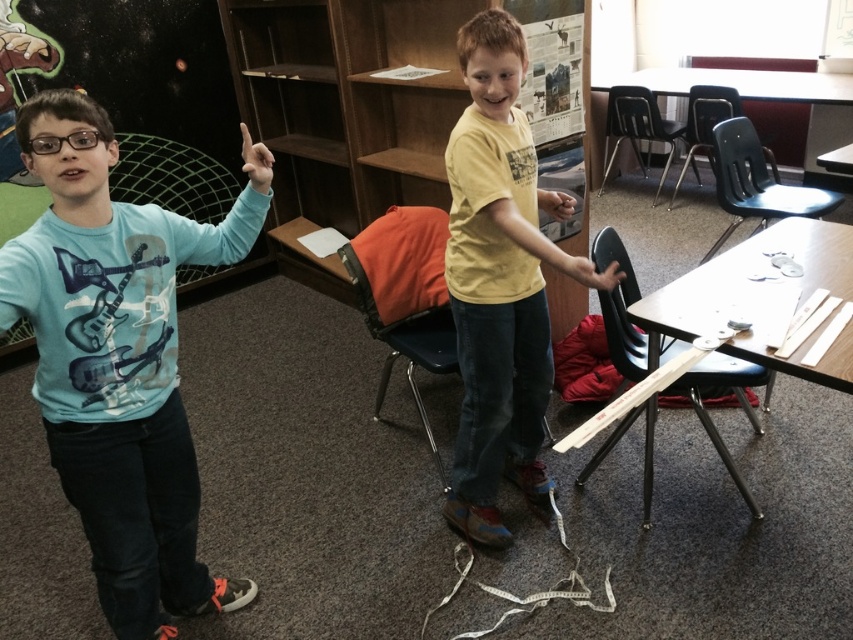
Is point (350, 180) positioned before point (518, 394)?

That is False.

Is wooden bookshelf at center taller than yellow matte shirt at center?

Indeed, wooden bookshelf at center has a greater height compared to yellow matte shirt at center.

Between point (323, 163) and point (466, 419), which one is positioned in front?

Positioned in front is point (466, 419).

The image size is (853, 640). Identify the location of wooden bookshelf at center. 345,109.

Who is shorter, matte blue shirt at left or matte skin hand at upper center?

matte skin hand at upper center

The height and width of the screenshot is (640, 853). Identify the location of matte blue shirt at left. click(x=117, y=362).

Which is in front, point (90, 445) or point (254, 189)?

Point (90, 445) is in front.

This screenshot has width=853, height=640. Find the location of `matte blue shirt at left`. matte blue shirt at left is located at coordinates (117, 362).

Who is more forward, (489,83) or (612,273)?

Point (612,273) is more forward.

Can you confirm if yellow matte shirt at center is thinner than smooth skin hand at center?

Incorrect, yellow matte shirt at center's width is not less than smooth skin hand at center's.

I want to click on yellow matte shirt at center, so click(495, 284).